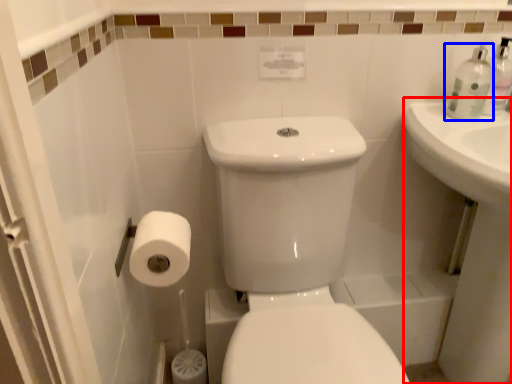
Question: Which object appears closest to the camera in this image, counter top (highlighted by a red box) or toiletry (highlighted by a blue box)?

Choices:
 (A) counter top
 (B) toiletry

Answer: (A)